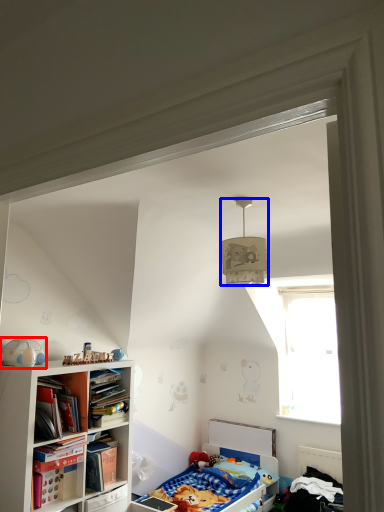
Question: Which object appears farthest to the camera in this image, toy (highlighted by a red box) or lamp (highlighted by a blue box)?

Choices:
 (A) toy
 (B) lamp

Answer: (A)